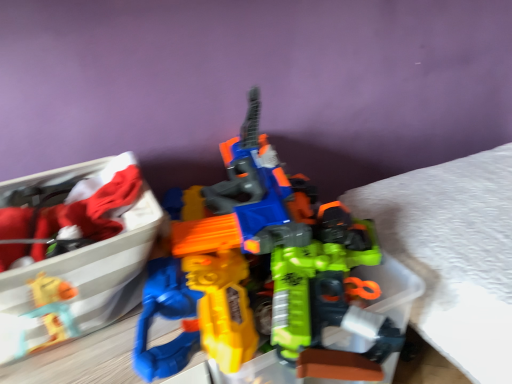
Question: Does matte plastic toy gun at left appear on the right side of matte plastic toy gun at center?

Choices:
 (A) no
 (B) yes

Answer: (A)

Question: Does matte plastic toy gun at left have a larger size compared to matte plastic toy gun at center?

Choices:
 (A) no
 (B) yes

Answer: (A)

Question: Is matte plastic toy gun at left located outside matte plastic toy gun at center?

Choices:
 (A) yes
 (B) no

Answer: (B)

Question: Is matte plastic toy gun at left positioned far away from matte plastic toy gun at center?

Choices:
 (A) no
 (B) yes

Answer: (A)

Question: From the image's perspective, is matte plastic toy gun at left located beneath matte plastic toy gun at center?

Choices:
 (A) yes
 (B) no

Answer: (A)

Question: From the image's perspective, is matte plastic toy gun at left on matte plastic toy gun at center?

Choices:
 (A) no
 (B) yes

Answer: (A)

Question: Considering the relative positions of matte plastic toy gun at center and matte plastic toy gun at left in the image provided, is matte plastic toy gun at center to the left of matte plastic toy gun at left from the viewer's perspective?

Choices:
 (A) no
 (B) yes

Answer: (A)

Question: Is matte plastic toy gun at center turned away from matte plastic toy gun at left?

Choices:
 (A) no
 (B) yes

Answer: (A)

Question: Can you confirm if matte plastic toy gun at center is smaller than matte plastic toy gun at left?

Choices:
 (A) no
 (B) yes

Answer: (A)

Question: Is matte plastic toy gun at center positioned behind matte plastic toy gun at left?

Choices:
 (A) no
 (B) yes

Answer: (A)

Question: Considering the relative sizes of matte plastic toy gun at center and matte plastic toy gun at left in the image provided, is matte plastic toy gun at center wider than matte plastic toy gun at left?

Choices:
 (A) no
 (B) yes

Answer: (B)

Question: From the image's perspective, is matte plastic toy gun at center located above matte plastic toy gun at left?

Choices:
 (A) yes
 (B) no

Answer: (A)

Question: Considering the positions of matte plastic toy gun at center and matte plastic toy gun at left in the image, is matte plastic toy gun at center taller or shorter than matte plastic toy gun at left?

Choices:
 (A) tall
 (B) short

Answer: (A)